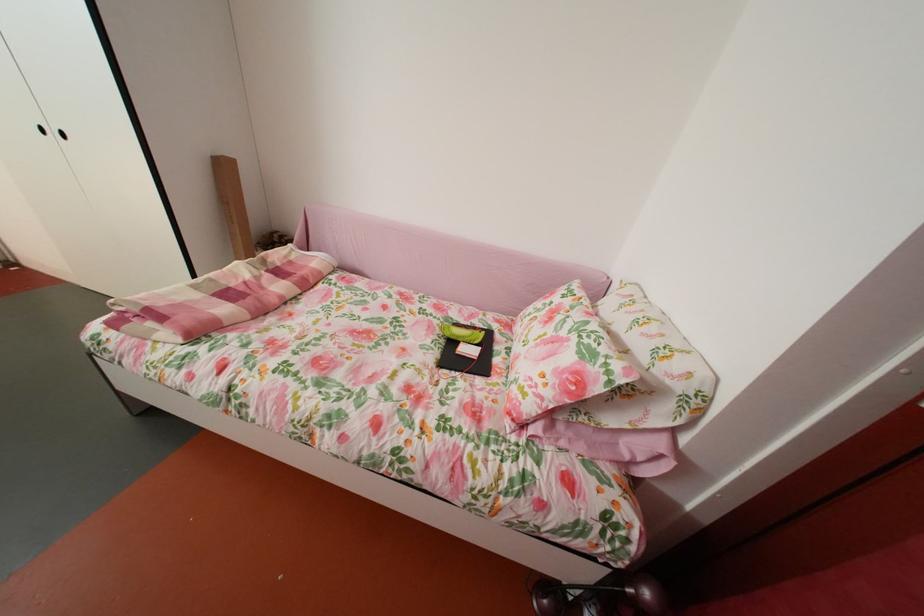
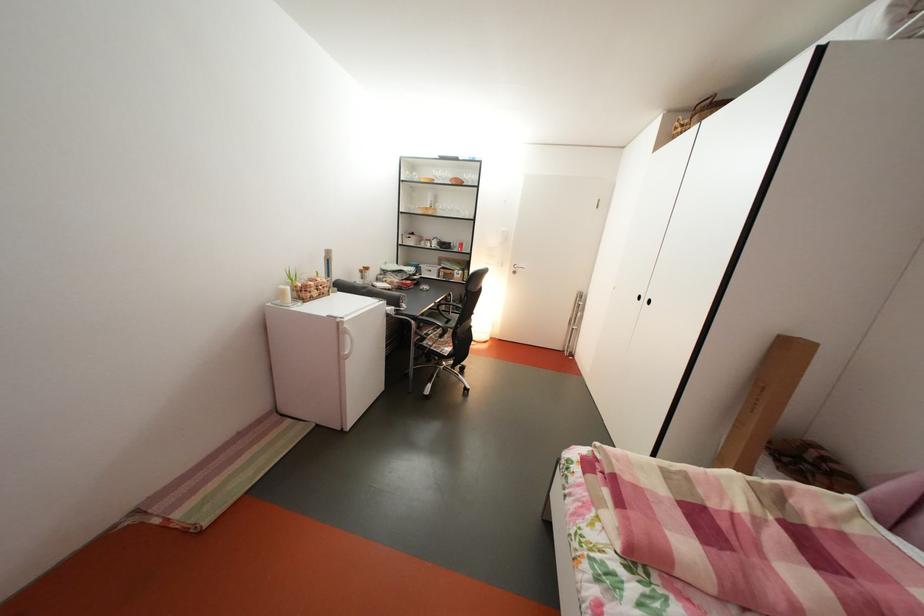
Question: The first image is from the beginning of the video and the second image is from the end. How did the camera likely rotate when shooting the video?

Choices:
 (A) Left
 (B) Right
 (C) Up
 (D) Down

Answer: (A)